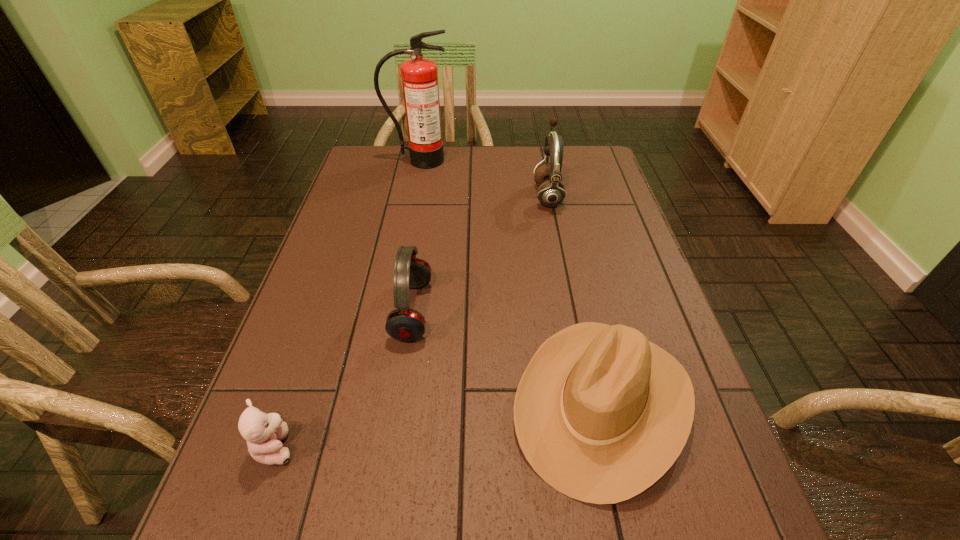
Locate an element on the screen. This screenshot has height=540, width=960. the farthest object is located at coordinates (419, 75).

You are a GUI agent. You are given a task and a screenshot of the screen. Output one action in this format:
    pyautogui.click(x=<x>, y=<y>)
    Task: Click on the fire extinguisher
    
    Given the screenshot: What is the action you would take?
    pyautogui.click(x=419, y=75)

Find the location of a particular element. Image resolution: width=960 pixels, height=540 pixels. the farther earphone is located at coordinates (551, 193).

You are a GUI agent. You are given a task and a screenshot of the screen. Output one action in this format:
    pyautogui.click(x=<x>, y=<y>)
    Task: Click on the fourth shortest object
    The height and width of the screenshot is (540, 960).
    Given the screenshot: What is the action you would take?
    pyautogui.click(x=551, y=193)

This screenshot has height=540, width=960. Identify the location of the nearer earphone. (404, 324).

Find the location of a particular element. This screenshot has width=960, height=540. the shorter earphone is located at coordinates (404, 324).

Find the location of `cowboy hat`. cowboy hat is located at coordinates (601, 413).

This screenshot has width=960, height=540. Find the location of `teddy bear`. teddy bear is located at coordinates (263, 432).

Locate an element on the screen. the shortest object is located at coordinates pos(263,432).

The image size is (960, 540). What are the coordinates of `free space located 0.180m on the front-facing side of the farthest object` in the screenshot? It's located at (411, 200).